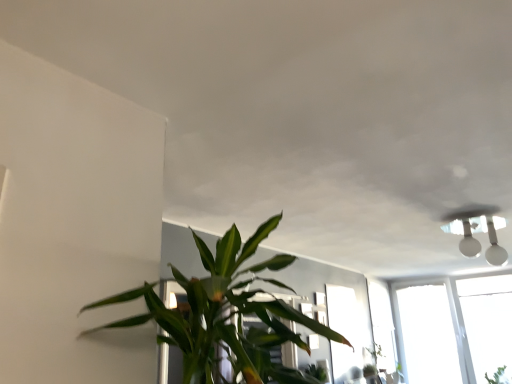
Question: Is transparent glass window at center outside green leafy plant at lower right?

Choices:
 (A) yes
 (B) no

Answer: (A)

Question: Is transparent glass window at center far away from green leafy plant at lower right?

Choices:
 (A) yes
 (B) no

Answer: (A)

Question: Is transparent glass window at center looking in the opposite direction of green leafy plant at lower right?

Choices:
 (A) yes
 (B) no

Answer: (B)

Question: Can you confirm if transparent glass window at center is wider than green leafy plant at lower right?

Choices:
 (A) no
 (B) yes

Answer: (A)

Question: Is transparent glass window at center at the left side of green leafy plant at lower right?

Choices:
 (A) no
 (B) yes

Answer: (B)

Question: From a real-world perspective, is transparent glass window at center located beneath green leafy plant at lower right?

Choices:
 (A) yes
 (B) no

Answer: (B)

Question: From a real-world perspective, does green leafy plant at center sit lower than transparent glass window at center?

Choices:
 (A) yes
 (B) no

Answer: (B)

Question: Does green leafy plant at center appear on the left side of transparent glass window at center?

Choices:
 (A) yes
 (B) no

Answer: (A)

Question: Is green leafy plant at center oriented away from transparent glass window at center?

Choices:
 (A) yes
 (B) no

Answer: (A)

Question: Is green leafy plant at center taller than transparent glass window at center?

Choices:
 (A) yes
 (B) no

Answer: (B)

Question: Is green leafy plant at center at the right side of transparent glass window at center?

Choices:
 (A) yes
 (B) no

Answer: (B)

Question: Is green leafy plant at center positioned beyond the bounds of transparent glass window at center?

Choices:
 (A) no
 (B) yes

Answer: (B)

Question: From the image's perspective, is transparent glass window at center on green leafy plant at center?

Choices:
 (A) yes
 (B) no

Answer: (B)